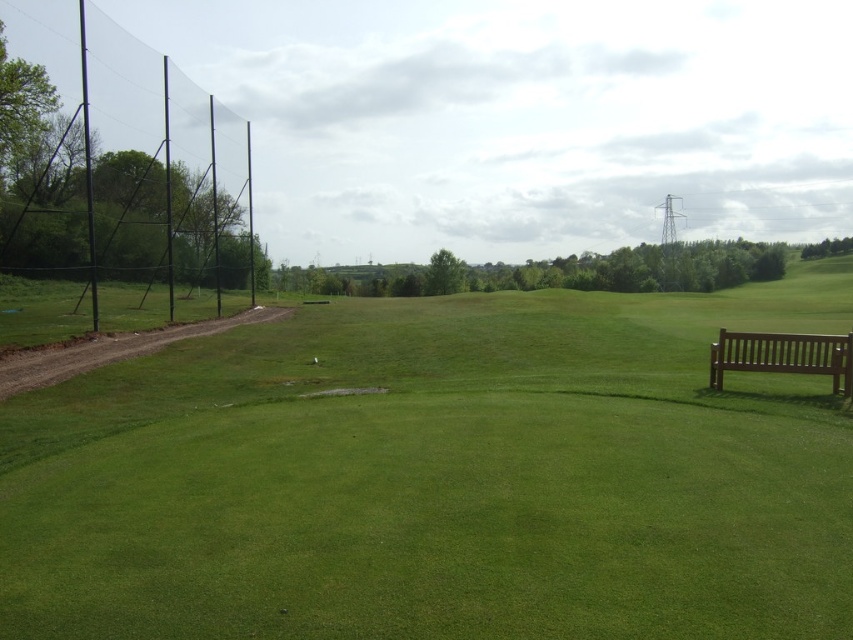
Based on the photo, does green smooth grass at center have a smaller size compared to brown wooden bench at right?

Actually, green smooth grass at center might be larger than brown wooden bench at right.

Does green smooth grass at center have a greater height compared to brown wooden bench at right?

Yes.

Is point (521, 580) positioned after point (802, 352)?

No, it is in front of (802, 352).

I want to click on green smooth grass at center, so click(x=440, y=476).